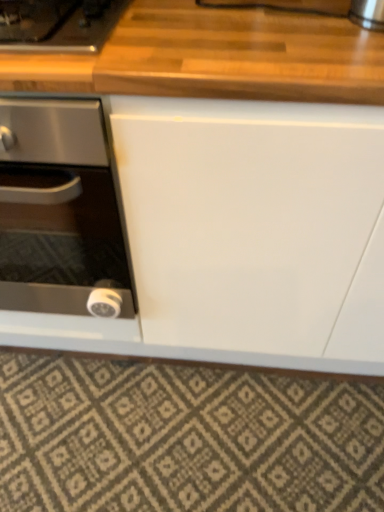
Locate an element on the screen. textured beige rug at lower center is located at coordinates (184, 438).

Does black glass stove at left touch wooden gas stove at upper left?

They are not placed beside each other.

Which is less distant, (63, 251) or (104, 38)?

Point (63, 251) appears to be farther away from the viewer than point (104, 38).

Which is behind, black glass stove at left or wooden gas stove at upper left?

wooden gas stove at upper left is more distant.

Is wooden gas stove at upper left to the left of black glass stove at left from the viewer's perspective?

In fact, wooden gas stove at upper left is to the right of black glass stove at left.

Which is further, (78, 45) or (23, 291)?

The point (23, 291) is more distant.

Based on the photo, from a real-world perspective, between wooden gas stove at upper left and black glass stove at left, who is vertically higher?

wooden gas stove at upper left.

Image resolution: width=384 pixels, height=512 pixels. I want to click on gas stove on the right of black glass stove at left, so click(x=57, y=24).

In terms of width, does textured beige rug at lower center look wider or thinner when compared to black glass stove at left?

Clearly, textured beige rug at lower center has less width compared to black glass stove at left.

The image size is (384, 512). What are the coordinates of `kitchen appliance in front of the textured beige rug at lower center` in the screenshot? It's located at (60, 211).

Could you tell me if textured beige rug at lower center is turned towards black glass stove at left?

No, textured beige rug at lower center is not facing towards black glass stove at left.

Which is behind, black glass stove at left or textured beige rug at lower center?

textured beige rug at lower center is further away from the camera.

Can you tell me how much black glass stove at left and textured beige rug at lower center differ in facing direction?

black glass stove at left and textured beige rug at lower center are facing 0.504 degrees away from each other.

From a real-world perspective, which is physically above, black glass stove at left or textured beige rug at lower center?

In real-world perspective, black glass stove at left is above.

Is point (48, 99) closer or farther from the camera than point (139, 393)?

Point (48, 99) is closer to the camera than point (139, 393).

Considering the positions of point (197, 426) and point (77, 21), is point (197, 426) closer or farther from the camera than point (77, 21)?

Clearly, point (197, 426) is more distant from the camera than point (77, 21).

From the image's perspective, is textured beige rug at lower center above or below wooden gas stove at upper left?

Clearly, from the image's perspective, textured beige rug at lower center is below wooden gas stove at upper left.

From a real-world perspective, who is located higher, textured beige rug at lower center or wooden gas stove at upper left?

wooden gas stove at upper left is physically above.

In the scene shown: Can you confirm if textured beige rug at lower center is thinner than wooden gas stove at upper left?

Correct, the width of textured beige rug at lower center is less than that of wooden gas stove at upper left.

Can you confirm if wooden gas stove at upper left is smaller than textured beige rug at lower center?

Incorrect, wooden gas stove at upper left is not smaller in size than textured beige rug at lower center.

Does point (0, 9) appear closer or farther from the camera than point (36, 489)?

Point (0, 9) is positioned closer to the camera compared to point (36, 489).

You are a GUI agent. You are given a task and a screenshot of the screen. Output one action in this format:
    pyautogui.click(x=<x>, y=<y>)
    Task: Click on the gas stove that appears above the textured beige rug at lower center (from a real-world perspective)
    
    Given the screenshot: What is the action you would take?
    pyautogui.click(x=57, y=24)

Which is correct: wooden gas stove at upper left is inside textured beige rug at lower center, or outside of it?

The correct answer is: outside.

Where is `kitchen appliance below the wooden gas stove at upper left (from the image's perspective)`? kitchen appliance below the wooden gas stove at upper left (from the image's perspective) is located at coordinates (60, 211).

Where is `gas stove behind the black glass stove at left`? This screenshot has height=512, width=384. gas stove behind the black glass stove at left is located at coordinates (57, 24).

When comparing their distances from black glass stove at left, does textured beige rug at lower center or wooden gas stove at upper left seem further?

Among the two, textured beige rug at lower center is located further to black glass stove at left.

Based on their spatial positions, is black glass stove at left or textured beige rug at lower center closer to wooden gas stove at upper left?

black glass stove at left.

Which object lies further to the anchor point textured beige rug at lower center, wooden gas stove at upper left or black glass stove at left?

The object further to textured beige rug at lower center is wooden gas stove at upper left.

Considering their positions, is black glass stove at left positioned further to textured beige rug at lower center than wooden gas stove at upper left?

The object further to textured beige rug at lower center is wooden gas stove at upper left.

Which object lies further to the anchor point wooden gas stove at upper left, textured beige rug at lower center or black glass stove at left?

textured beige rug at lower center is further to wooden gas stove at upper left.

Estimate the real-world distances between objects in this image. Which object is closer to black glass stove at left, wooden gas stove at upper left or textured beige rug at lower center?

wooden gas stove at upper left is closer to black glass stove at left.

Locate an element on the screen. This screenshot has width=384, height=512. kitchen appliance between wooden gas stove at upper left and textured beige rug at lower center in the up-down direction is located at coordinates [60, 211].